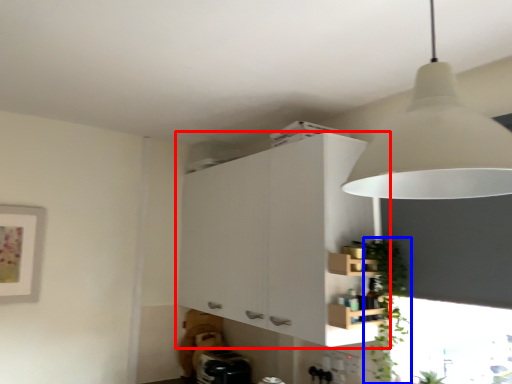
Question: Which object is closer to the camera taking this photo, cabinetry (highlighted by a red box) or plant (highlighted by a blue box)?

Choices:
 (A) cabinetry
 (B) plant

Answer: (B)